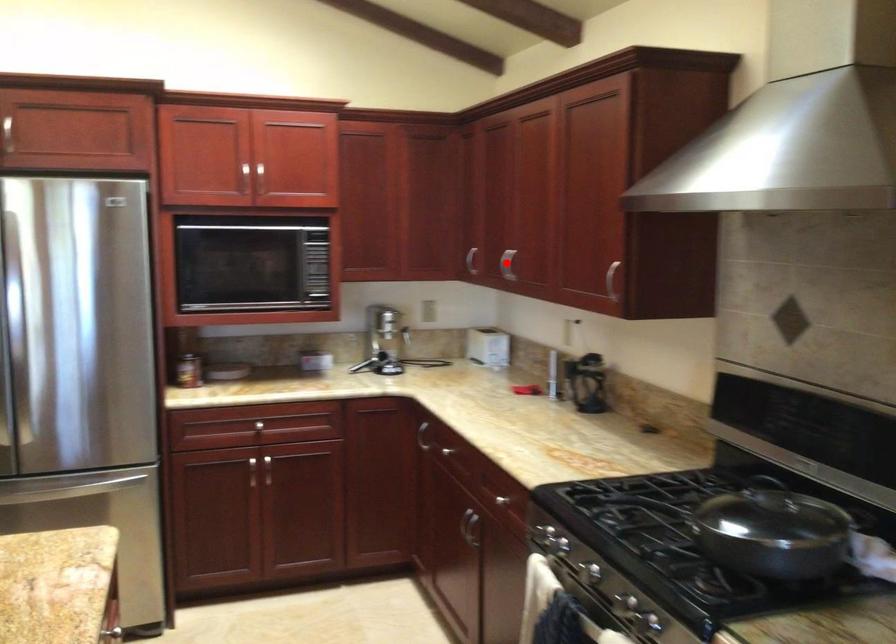
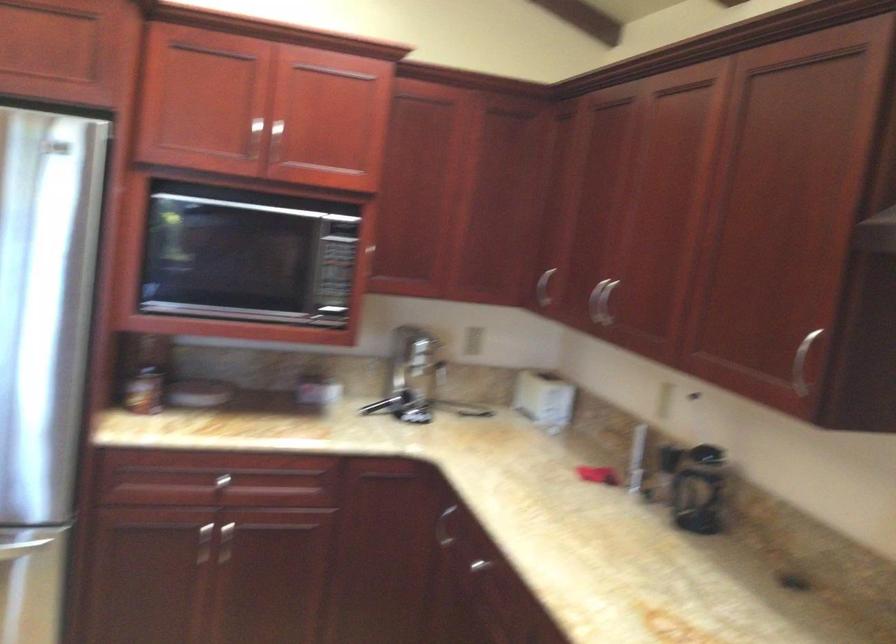
Question: I am providing you with two images of the same scene from different viewpoints. A red point is shown in image1. For the corresponding object point in image2, is it positioned nearer or farther from the camera?

Choices:
 (A) Nearer
 (B) Farther

Answer: (A)